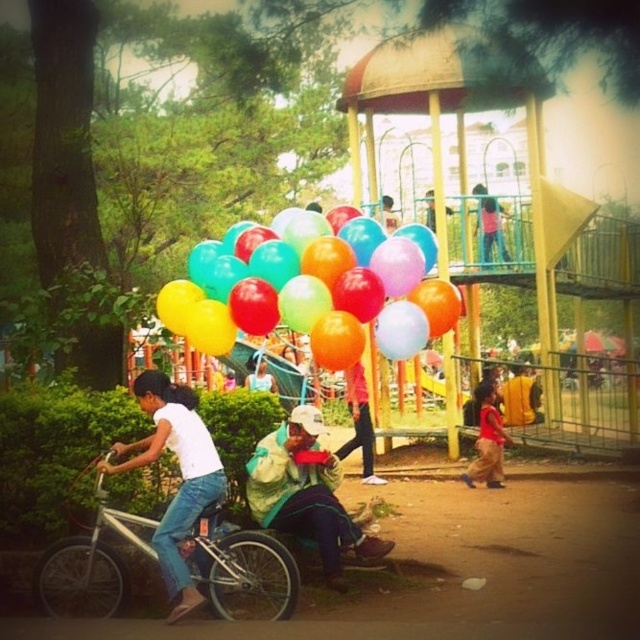
Which is more to the right, silver metallic bicycle at center or red cotton shirt at lower right?

Positioned to the right is red cotton shirt at lower right.

Is silver metallic bicycle at center to the right of red cotton shirt at lower right from the viewer's perspective?

→ Incorrect, silver metallic bicycle at center is not on the right side of red cotton shirt at lower right.

Locate an element on the screen. The height and width of the screenshot is (640, 640). silver metallic bicycle at center is located at coordinates (243, 570).

I want to click on silver metallic bicycle at center, so click(243, 570).

Looking at this image, is multicolored balloons at center to the left of red cotton shirt at lower right from the viewer's perspective?

Indeed, multicolored balloons at center is positioned on the left side of red cotton shirt at lower right.

You are a GUI agent. You are given a task and a screenshot of the screen. Output one action in this format:
    pyautogui.click(x=<x>, y=<y>)
    Task: Click on the multicolored balloons at center
    The height and width of the screenshot is (640, 640).
    Given the screenshot: What is the action you would take?
    [300, 288]

Image resolution: width=640 pixels, height=640 pixels. What do you see at coordinates (300, 288) in the screenshot? I see `multicolored balloons at center` at bounding box center [300, 288].

Identify the location of multicolored balloons at center. This screenshot has width=640, height=640. (300, 288).

Can you confirm if multicolored balloons at center is positioned below silver metallic bicycle at center?

A: Incorrect, multicolored balloons at center is not positioned below silver metallic bicycle at center.

Can you confirm if multicolored balloons at center is wider than silver metallic bicycle at center?

Yes.

Describe the element at coordinates (300, 288) in the screenshot. The width and height of the screenshot is (640, 640). I see `multicolored balloons at center` at that location.

Find the location of a particular element. The height and width of the screenshot is (640, 640). multicolored balloons at center is located at coordinates (300, 288).